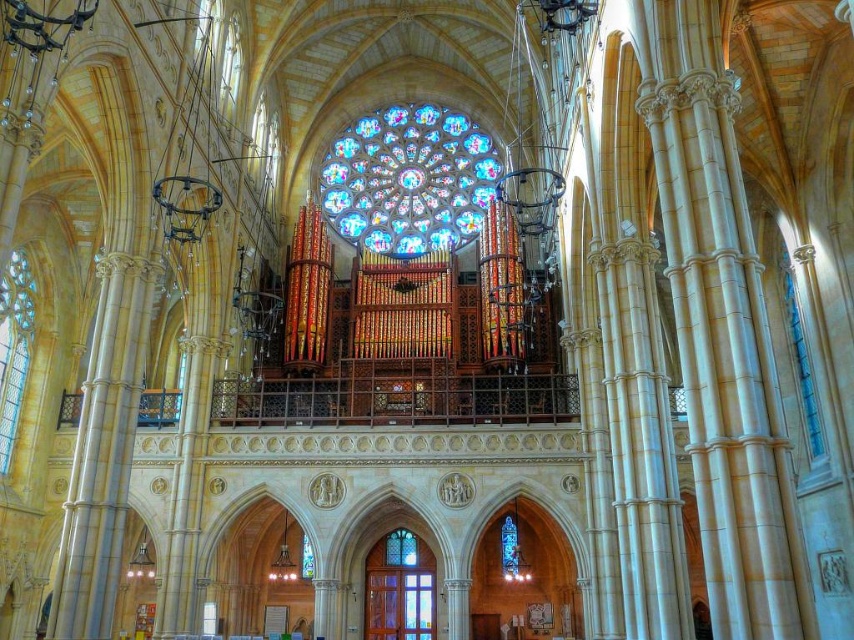
You are a visitor standing at the entrance of the cathedral. You see the translucent wooden door at lower center and the clear stained glass at left. Which object is shorter in height?

The translucent wooden door at lower center is not as tall as the clear stained glass at left, so the translucent wooden door at lower center is shorter in height.